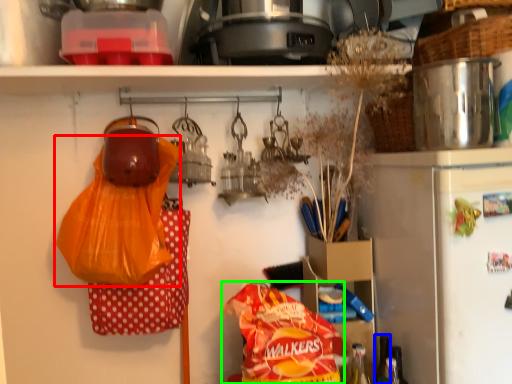
Question: Based on their relative distances, which object is nearer to plastic bag (highlighted by a red box)? Choose from bottle (highlighted by a blue box) and cereal (highlighted by a green box).

Choices:
 (A) bottle
 (B) cereal

Answer: (B)